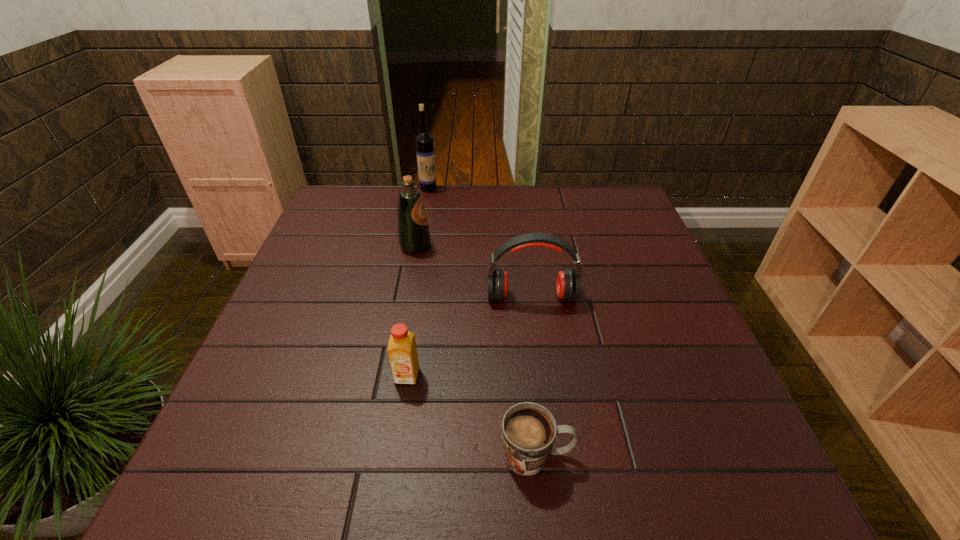
Locate an element on the screen. The height and width of the screenshot is (540, 960). vacant space at the right edge of the desktop is located at coordinates (693, 348).

The width and height of the screenshot is (960, 540). Identify the location of vacant space at the far left corner. (365, 192).

This screenshot has height=540, width=960. Find the location of `free space at the far right corner`. free space at the far right corner is located at coordinates (587, 217).

The height and width of the screenshot is (540, 960). What are the coordinates of `empty space that is in between the earphone and the wine bottle` in the screenshot? It's located at (480, 242).

Image resolution: width=960 pixels, height=540 pixels. Identify the location of vacant area between the second tallest object and the shortest object. (476, 350).

Locate an element on the screen. This screenshot has height=540, width=960. free space that is in between the orange juice and the earphone is located at coordinates (469, 336).

The image size is (960, 540). Identify the location of vacant space that's between the fourth farthest object and the olive oil. tap(411, 311).

This screenshot has width=960, height=540. I want to click on vacant area that lies between the wine bottle and the mug, so click(483, 322).

Identify the location of free space between the nearest object and the wine bottle. (483, 322).

Where is `vacant area between the tallest object and the earphone`? The image size is (960, 540). vacant area between the tallest object and the earphone is located at coordinates (480, 242).